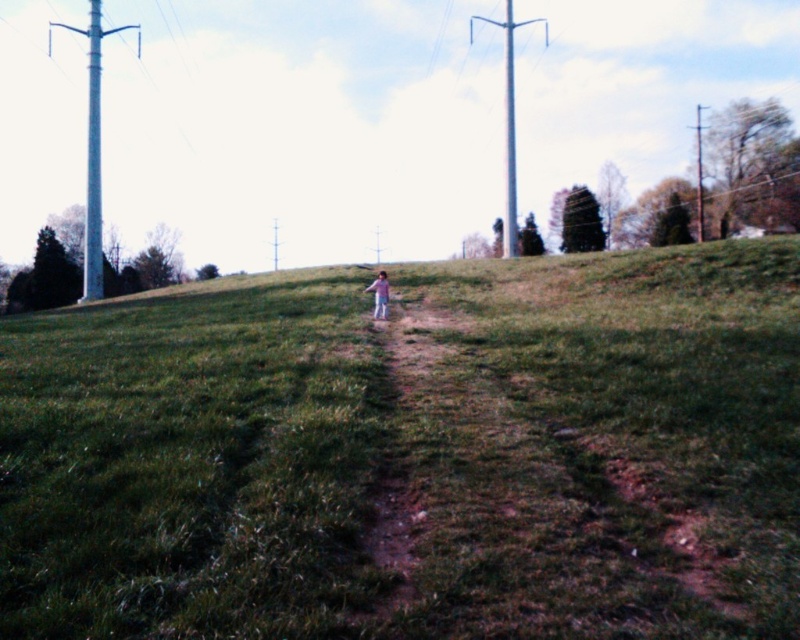
Does green grassy hill at center have a lesser width compared to dirt path at center?

No.

Does green grassy hill at center have a greater height compared to dirt path at center?

Correct, green grassy hill at center is much taller as dirt path at center.

Measure the distance between point (146,483) and camera.

Point (146,483) is 6.18 meters away from camera.

Locate an element on the screen. Image resolution: width=800 pixels, height=640 pixels. green grassy hill at center is located at coordinates (412, 454).

Who is shorter, metallic gray telegraph pole at upper center or purple cotton shirt at center?

Standing shorter between the two is purple cotton shirt at center.

Does point (500, 22) lie behind point (374, 317)?

Yes, it is.

Is point (509, 93) less distant than point (384, 288)?

No, (509, 93) is further to viewer.

Locate an element on the screen. metallic gray telegraph pole at upper center is located at coordinates (509, 120).

Is dirt path at center to the left of white metallic telegraph pole at left from the viewer's perspective?

No, dirt path at center is not to the left of white metallic telegraph pole at left.

Can you confirm if dirt path at center is shorter than white metallic telegraph pole at left?

Yes.

Does point (440, 577) come farther from viewer compared to point (92, 51)?

That is False.

I want to click on dirt path at center, so click(x=528, y=506).